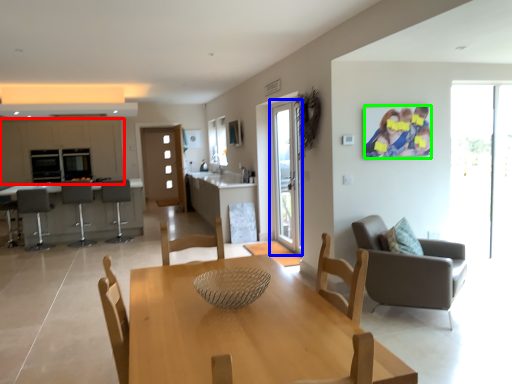
Question: Which object is positioned farthest from cabinetry (highlighted by a red box)? Select from screen door (highlighted by a blue box) and couple (highlighted by a green box).

Choices:
 (A) screen door
 (B) couple

Answer: (B)